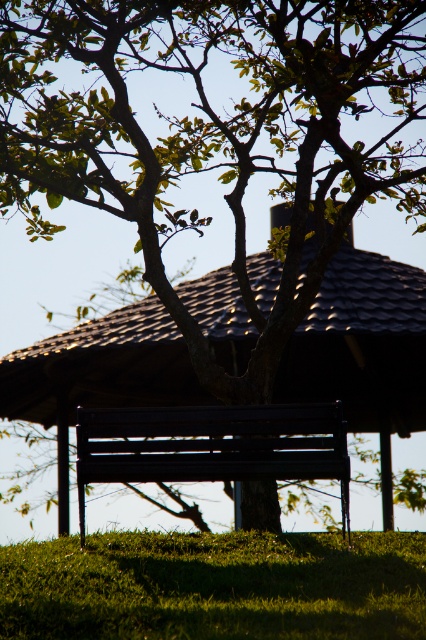
Question: Can you confirm if green grassy at lower center is wider than matte black bench at center?

Choices:
 (A) no
 (B) yes

Answer: (A)

Question: Which point is closer to the camera?

Choices:
 (A) (103, 586)
 (B) (218, 412)

Answer: (A)

Question: Does green grassy at lower center appear under matte black bench at center?

Choices:
 (A) no
 (B) yes

Answer: (B)

Question: Which point is closer to the camera taking this photo?

Choices:
 (A) (333, 449)
 (B) (69, 586)

Answer: (B)

Question: Considering the relative positions of green grassy at lower center and matte black bench at center in the image provided, where is green grassy at lower center located with respect to matte black bench at center?

Choices:
 (A) right
 (B) left

Answer: (A)